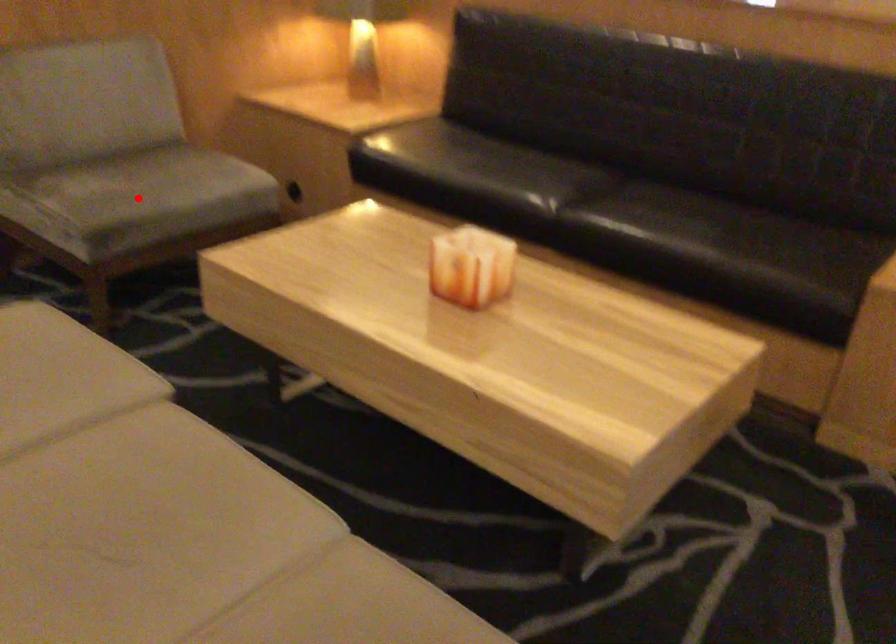
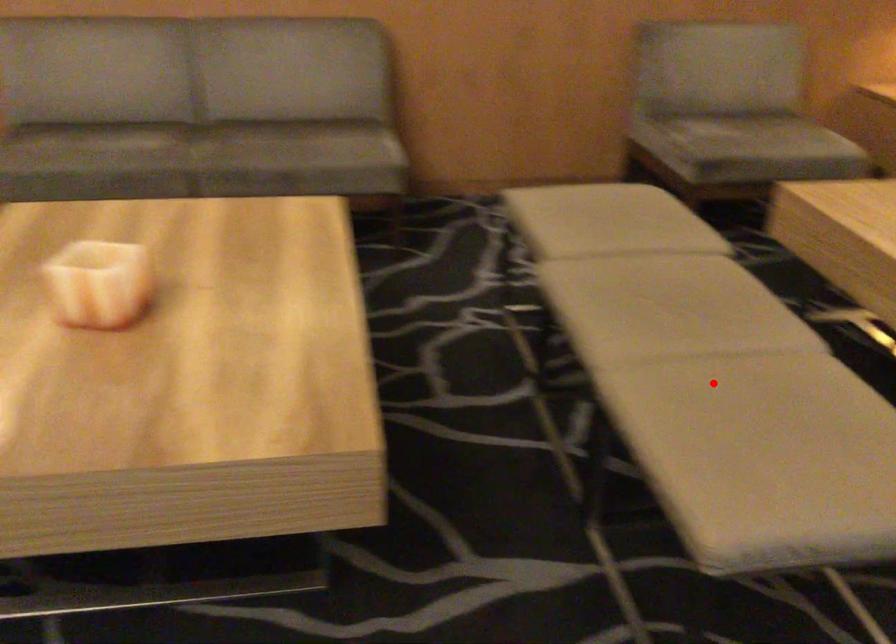
I am providing you with two images of the same scene from different viewpoints. A red point is marked on the first image and another point is marked on the second image. Is the red point in image1 aligned with the point shown in image2?

No